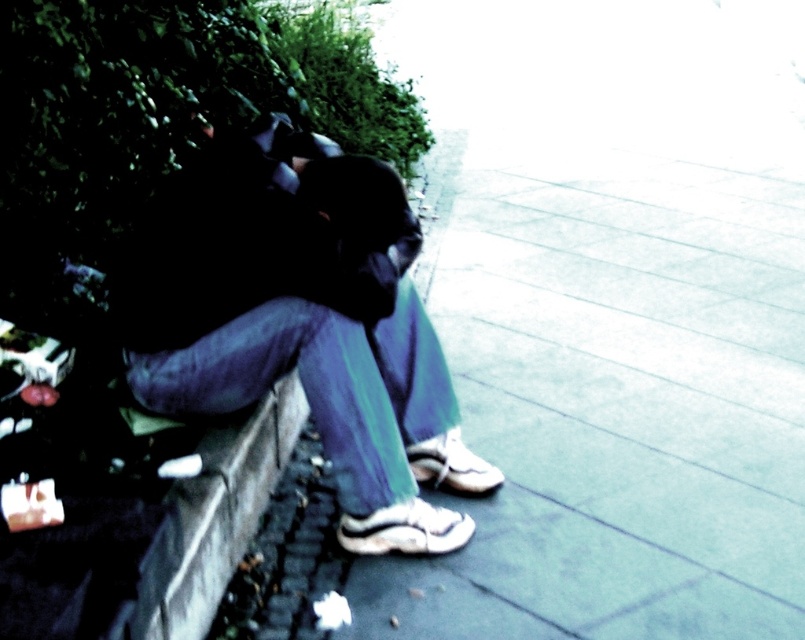
Question: Does smooth concrete pavement at center lie in front of matte black jacket at center?

Choices:
 (A) no
 (B) yes

Answer: (A)

Question: Is matte black jacket at center thinner than gray concrete curb at lower left?

Choices:
 (A) yes
 (B) no

Answer: (B)

Question: Which point is closer to the camera?

Choices:
 (A) matte black jacket at center
 (B) smooth concrete pavement at center
 (C) gray concrete curb at lower left

Answer: (C)

Question: Is smooth concrete pavement at center thinner than matte black jacket at center?

Choices:
 (A) yes
 (B) no

Answer: (B)

Question: Which is nearer to the matte black jacket at center?

Choices:
 (A) smooth concrete pavement at center
 (B) gray concrete curb at lower left

Answer: (B)

Question: Which point is farther to the camera?

Choices:
 (A) matte black jacket at center
 (B) gray concrete curb at lower left

Answer: (A)